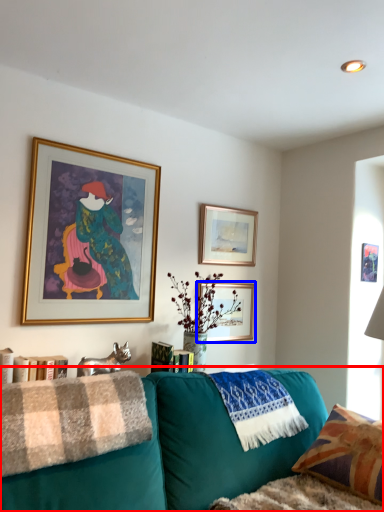
Question: Which point is further to the camera, studio couch (highlighted by a red box) or picture frame (highlighted by a blue box)?

Choices:
 (A) studio couch
 (B) picture frame

Answer: (B)